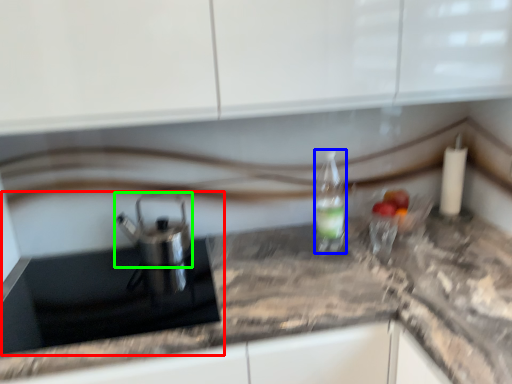
Question: Which object is the closest to the sink (highlighted by a red box)? Choose among these: bottle (highlighted by a blue box) or tea pot (highlighted by a green box).

Choices:
 (A) bottle
 (B) tea pot

Answer: (B)